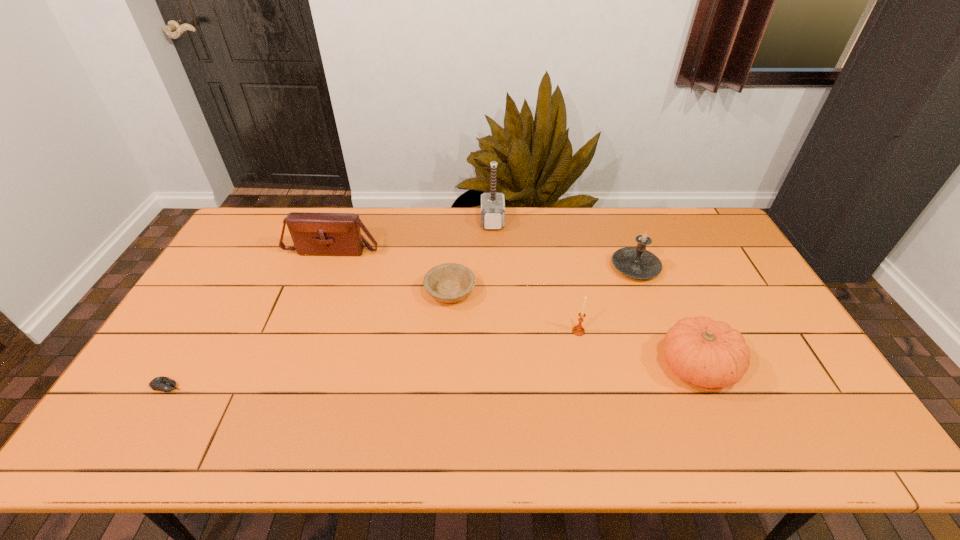
Find the location of a particular element. The image size is (960, 540). hammer that is at the far edge is located at coordinates point(492,204).

Where is `shoulder bag that is at the far edge`? shoulder bag that is at the far edge is located at coordinates (322, 234).

Find the location of a particular element. The width and height of the screenshot is (960, 540). object that is at the left edge is located at coordinates (161, 383).

This screenshot has width=960, height=540. Identify the location of vacant area at the far edge. pyautogui.click(x=429, y=229).

You are a GUI agent. You are given a task and a screenshot of the screen. Output one action in this format:
    pyautogui.click(x=<x>, y=<y>)
    Task: Click on the vacant space at the near edge of the desktop
    Image resolution: width=960 pixels, height=540 pixels.
    Given the screenshot: What is the action you would take?
    pyautogui.click(x=180, y=435)

This screenshot has width=960, height=540. I want to click on vacant point at the left edge, so click(x=267, y=260).

This screenshot has width=960, height=540. I want to click on free space at the right edge of the desktop, so click(709, 249).

I want to click on free space at the far left corner of the desktop, so click(273, 247).

Image resolution: width=960 pixels, height=540 pixels. I want to click on free space at the far right corner of the desktop, so click(676, 209).

Identify the location of vacant point located between the pumpkin and the fourth object from left to right. (594, 294).